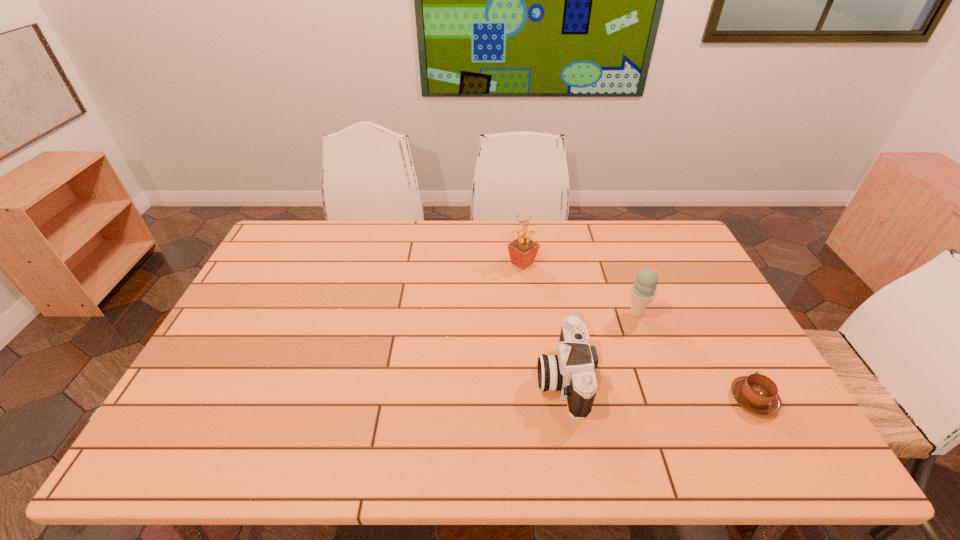
Where is `the farthest object`? The image size is (960, 540). the farthest object is located at coordinates (523, 250).

Find the location of a particular element. Image resolution: width=960 pixels, height=540 pixels. the second farthest object is located at coordinates (643, 291).

Identify the location of ice cream. (643, 291).

This screenshot has width=960, height=540. In order to click on camera in this screenshot , I will do `click(571, 372)`.

I want to click on the shortest object, so click(757, 393).

This screenshot has width=960, height=540. In order to click on the rightmost object in this screenshot , I will do `click(757, 393)`.

Find the location of `vacant area located at the front of the sunflower with flowers visible`. vacant area located at the front of the sunflower with flowers visible is located at coordinates (465, 263).

The image size is (960, 540). I want to click on vacant area located at the front of the sunflower with flowers visible, so click(x=432, y=263).

At what (x,y) coordinates should I click in order to perform the action: click on vacant point located at the front of the sunflower with flowers visible. Please return your answer as a coordinate pair (x, y). Image resolution: width=960 pixels, height=540 pixels. Looking at the image, I should click on (x=438, y=263).

Locate an element on the screen. This screenshot has width=960, height=540. vacant region located on the back of the second object from right to left is located at coordinates (616, 260).